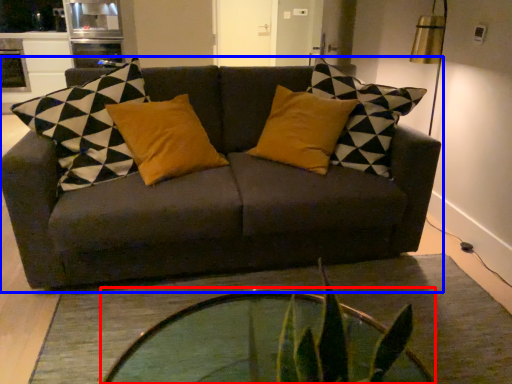
Question: Which point is closer to the camera, coffee table (highlighted by a red box) or studio couch (highlighted by a blue box)?

Choices:
 (A) coffee table
 (B) studio couch

Answer: (A)